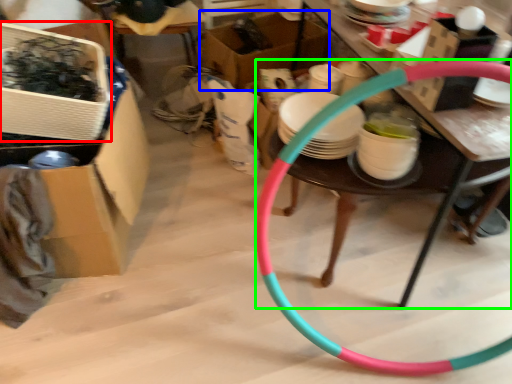
Question: Considering the real-world distances, which object is farthest from box (highlighted by a red box)? box (highlighted by a blue box) or table (highlighted by a green box)?

Choices:
 (A) box
 (B) table

Answer: (A)